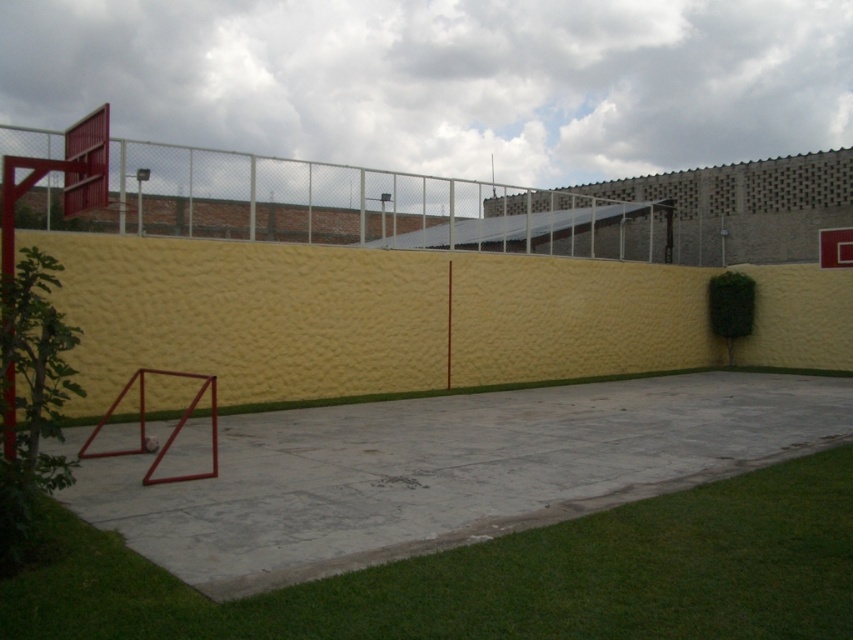
Is green grass at lower left shorter than metallic red basketball hoop at upper left?

Yes, green grass at lower left is shorter than metallic red basketball hoop at upper left.

Based on the photo, is green grass at lower left wider than metallic red basketball hoop at upper left?

Incorrect, green grass at lower left's width does not surpass metallic red basketball hoop at upper left's.

Does point (664, 618) lie behind point (83, 168)?

No.

Find the location of `green grass at lower left`. green grass at lower left is located at coordinates (500, 577).